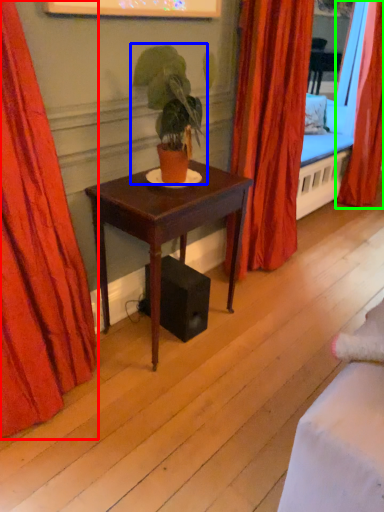
Question: Which object is the closest to the curtain (highlighted by a red box)? Choose among these: houseplant (highlighted by a blue box) or curtain (highlighted by a green box).

Choices:
 (A) houseplant
 (B) curtain

Answer: (A)